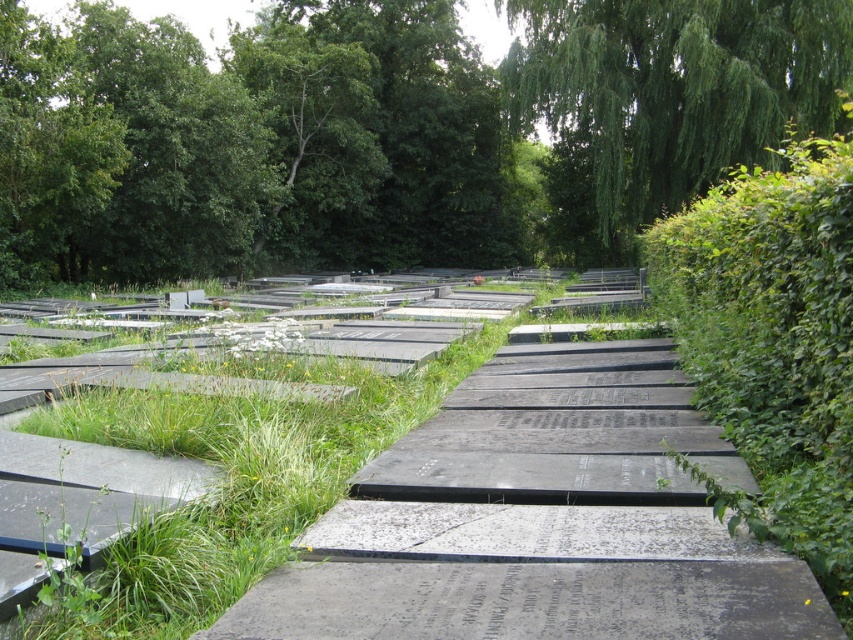
You are a landscape architect evaluating the cemetery layout. You notice the green leafy tree at upper center and the green leafy hedge at right. Which one would cast a larger shadow during midday?

The green leafy tree at upper center is bigger than the green leafy hedge at right, so it would cast a larger shadow during midday.

You are standing in the cemetery and want to take a photo of the green leafy tree at upper right without the green leafy tree at upper center blocking the view. Is this possible from your current position?

The green leafy tree at upper center is in front of the green leafy tree at upper right, so you cannot take a photo of the green leafy tree at upper right without the green leafy tree at upper center blocking the view from your current position.

You are standing in the cemetery and notice two green leafy trees in the background. Which tree, the green leafy tree at upper center or the green leafy tree at upper right, is located to the left of the other?

The green leafy tree at upper center is positioned on the left side of the green leafy tree at upper right.